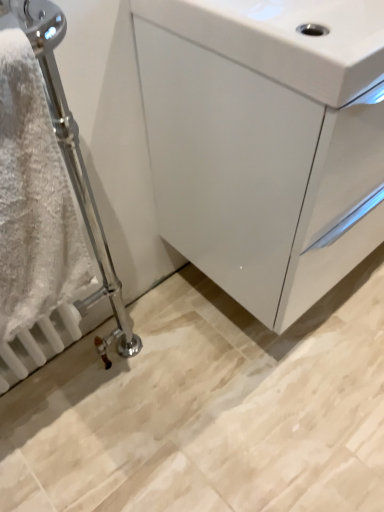
Question: Can you confirm if white fluffy towel at left is wider than white glossy cabinet at center?

Choices:
 (A) yes
 (B) no

Answer: (B)

Question: Considering the relative positions of white fluffy towel at left and white glossy cabinet at center in the image provided, is white fluffy towel at left in front of white glossy cabinet at center?

Choices:
 (A) no
 (B) yes

Answer: (B)

Question: Can you confirm if white fluffy towel at left is thinner than white glossy cabinet at center?

Choices:
 (A) yes
 (B) no

Answer: (A)

Question: Is white glossy cabinet at center at the back of white fluffy towel at left?

Choices:
 (A) no
 (B) yes

Answer: (A)

Question: Is white fluffy towel at left touching white glossy cabinet at center?

Choices:
 (A) yes
 (B) no

Answer: (B)

Question: Do you think white glossy sink at upper right is within white glossy cabinet at center, or outside of it?

Choices:
 (A) inside
 (B) outside

Answer: (A)

Question: From the image's perspective, is white glossy sink at upper right above or below white glossy cabinet at center?

Choices:
 (A) above
 (B) below

Answer: (A)

Question: Is point (380, 30) closer or farther from the camera than point (226, 44)?

Choices:
 (A) closer
 (B) farther

Answer: (B)

Question: From their relative heights in the image, would you say white glossy sink at upper right is taller or shorter than white glossy cabinet at center?

Choices:
 (A) tall
 (B) short

Answer: (B)

Question: Is white glossy cabinet at center inside or outside of white glossy sink at upper right?

Choices:
 (A) inside
 (B) outside

Answer: (B)

Question: Considering their positions, is white glossy cabinet at center located in front of or behind white glossy sink at upper right?

Choices:
 (A) behind
 (B) front

Answer: (A)

Question: Is point (248, 224) closer or farther from the camera than point (344, 49)?

Choices:
 (A) closer
 (B) farther

Answer: (B)

Question: In terms of size, does white glossy cabinet at center appear bigger or smaller than white glossy sink at upper right?

Choices:
 (A) big
 (B) small

Answer: (A)

Question: In terms of size, does white glossy sink at upper right appear bigger or smaller than white fluffy towel at left?

Choices:
 (A) small
 (B) big

Answer: (B)

Question: From their relative heights in the image, would you say white glossy sink at upper right is taller or shorter than white fluffy towel at left?

Choices:
 (A) short
 (B) tall

Answer: (A)